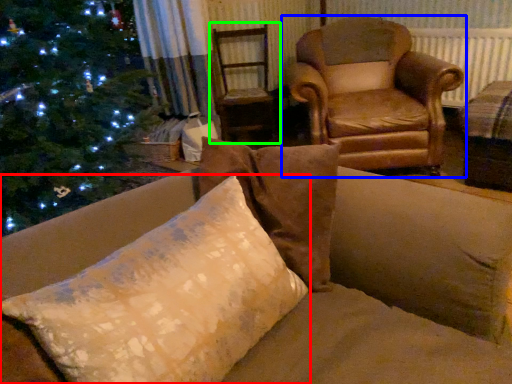
Question: Which object is the farthest from pillow (highlighted by a red box)? Choose among these: chair (highlighted by a blue box) or swivel chair (highlighted by a green box).

Choices:
 (A) chair
 (B) swivel chair

Answer: (B)